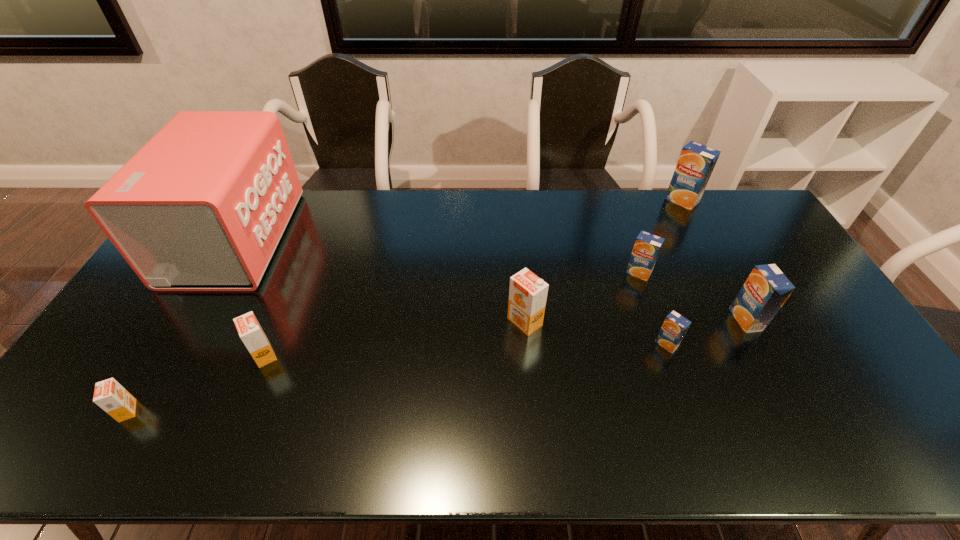
The image size is (960, 540). Identify the location of the second orange juice from left to right. (249, 329).

Find the location of `the nearest blue orange_juice`. the nearest blue orange_juice is located at coordinates (675, 326).

Find the location of a particular element. The width and height of the screenshot is (960, 540). the nearest orange orange juice is located at coordinates (114, 399).

This screenshot has width=960, height=540. I want to click on the nearest object, so click(x=114, y=399).

You are a GUI agent. You are given a task and a screenshot of the screen. Output one action in this format:
    pyautogui.click(x=<x>, y=<y>)
    Task: Click on the vacant space situated 0.330m on the surface of the pink box where the text is embossed
    This screenshot has height=540, width=960.
    Given the screenshot: What is the action you would take?
    383,238

At what (x,y) coordinates should I click in order to perform the action: click on free point located on the front of the tallest orange juice. Please return your answer as a coordinate pair (x, y). Looking at the image, I should click on (701, 235).

Locate an element on the screen. vacant space located on the front of the second nearest blue orange_juice is located at coordinates (794, 409).

Where is `vacant space located on the right of the farthest orange orange juice`? vacant space located on the right of the farthest orange orange juice is located at coordinates (563, 322).

You are a GUI agent. You are given a task and a screenshot of the screen. Output one action in this format:
    pyautogui.click(x=<x>, y=<y>)
    Task: Click on the blank area located 0.080m on the left of the second farthest orange juice
    
    Given the screenshot: What is the action you would take?
    pyautogui.click(x=600, y=273)

I want to click on free space located 0.160m on the front of the second farthest orange orange juice, so click(236, 426).